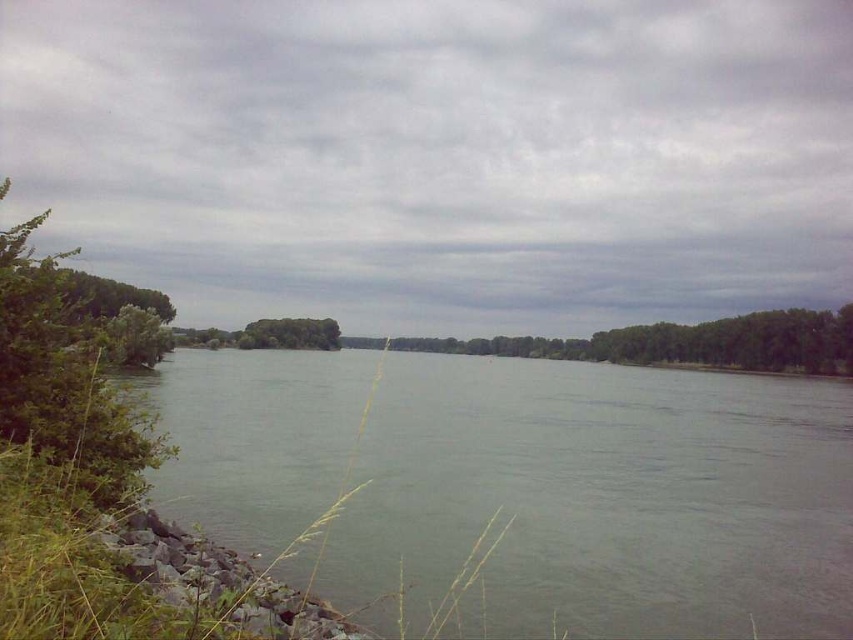
Is point (3, 371) positioned before point (635, 332)?

Yes.

Which is behind, point (79, 404) or point (630, 342)?

Point (630, 342)

Is point (13, 353) in front of point (744, 336)?

That is True.

The width and height of the screenshot is (853, 640). In order to click on green leafy shrub at left in this screenshot , I will do `click(65, 376)`.

Does point (477, 483) come in front of point (35, 289)?

No.

Does point (508, 592) come farther from viewer compared to point (132, 420)?

No, it is not.

The height and width of the screenshot is (640, 853). Find the location of `gray water at center`. gray water at center is located at coordinates (601, 499).

Which of these two, gray water at center or green leafy trees at center, stands taller?

With more height is green leafy trees at center.

Can you confirm if gray water at center is taller than green leafy trees at center?

No, gray water at center is not taller than green leafy trees at center.

Between point (819, 611) and point (846, 346), which one is positioned in front?

Point (819, 611)

The width and height of the screenshot is (853, 640). Identify the location of gray water at center. (601, 499).